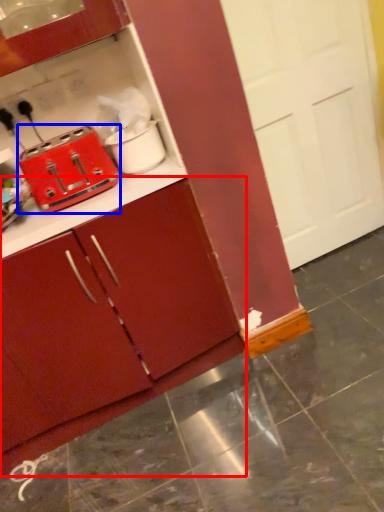
Question: Which object is further to the camera taking this photo, cabinetry (highlighted by a red box) or toaster (highlighted by a blue box)?

Choices:
 (A) cabinetry
 (B) toaster

Answer: (B)